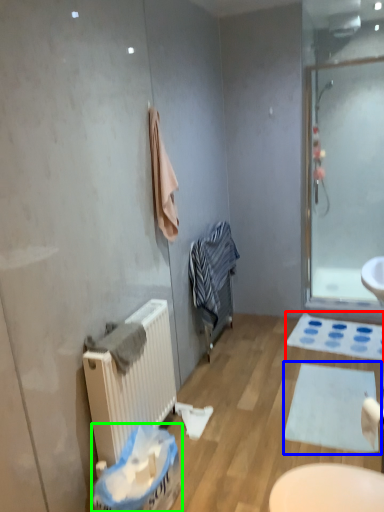
Question: Which object is the closest to the bath mat (highlighted by a red box)? Choose among these: bath mat (highlighted by a blue box) or laundry basket (highlighted by a green box).

Choices:
 (A) bath mat
 (B) laundry basket

Answer: (A)